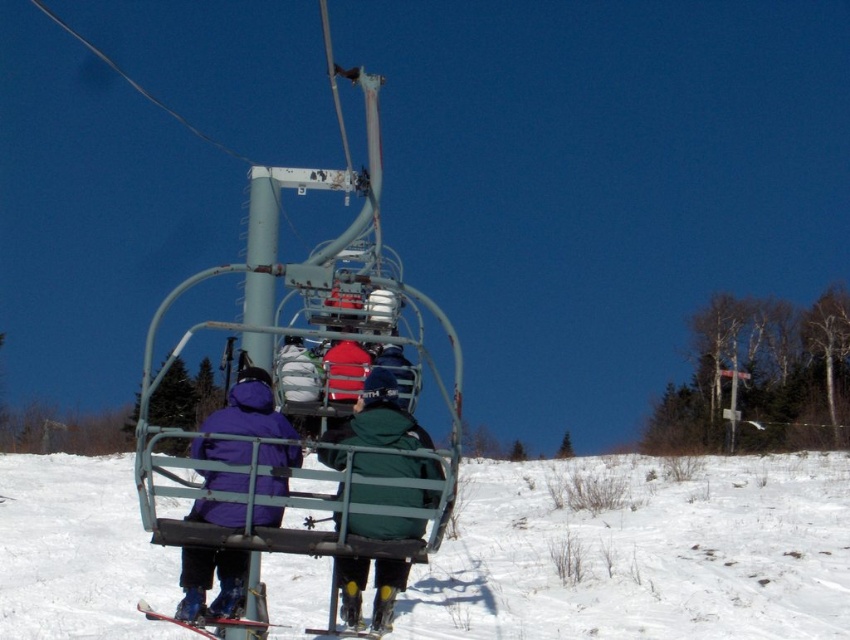
Is green matte jacket at center closer to camera compared to purple fleece jacket at left?

That is False.

Measure the distance between point (389, 445) and camera.

A distance of 8.28 meters exists between point (389, 445) and camera.

Identify the location of green matte jacket at center. (378, 419).

Locate an element on the screen. The image size is (850, 640). green matte jacket at center is located at coordinates (378, 419).

Does white powdery snow at center appear over green matte jacket at center?

Actually, white powdery snow at center is below green matte jacket at center.

Does white powdery snow at center have a larger size compared to green matte jacket at center?

Yes, white powdery snow at center is bigger than green matte jacket at center.

Is point (65, 538) farther from viewer compared to point (358, 609)?

Yes.

The width and height of the screenshot is (850, 640). I want to click on white powdery snow at center, so click(641, 554).

Does purple fleece jacket at left have a lesser height compared to matte black ski at lower center?

No.

Where is `purple fleece jacket at left`? purple fleece jacket at left is located at coordinates (211, 582).